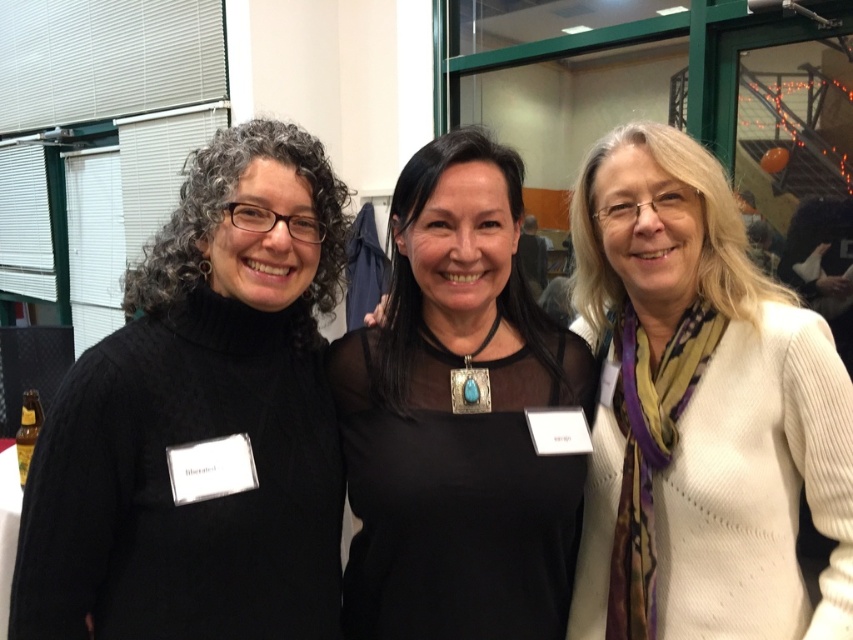
In the scene shown: You are organizing a clothing donation drive and need to categorize the sweaters by size. Given the black sweater at left and the white ribbed sweater at center, which sweater should be placed in the small size bin?

The black sweater at left has a smaller size compared to the white ribbed sweater at center, so it should be placed in the small size bin.

You are a photographer setting up for a group photo. You notice the black sweater at left and the white ribbed sweater at center. Which sweater is positioned lower in the image?

The black sweater at left is located below the white ribbed sweater at center, so it is positioned lower.

You are a photographer trying to adjust the camera focus on the white ribbed sweater at center and the black mesh top at center. Which of the two items should you focus on first if you want to ensure the taller one is in sharp focus?

The white ribbed sweater at center is much taller than the black mesh top at center, so you should focus on the white ribbed sweater at center first to ensure it is in sharp focus.